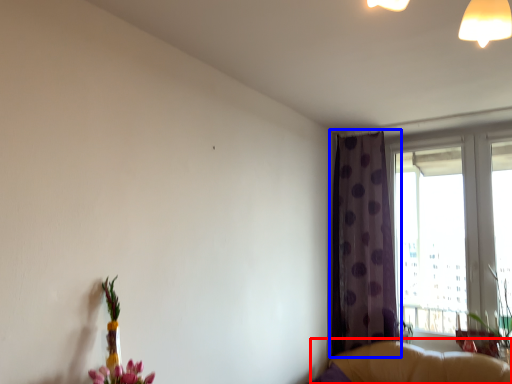
Question: Among these objects, which one is nearest to the camera, couch (highlighted by a red box) or curtain (highlighted by a blue box)?

Choices:
 (A) couch
 (B) curtain

Answer: (A)